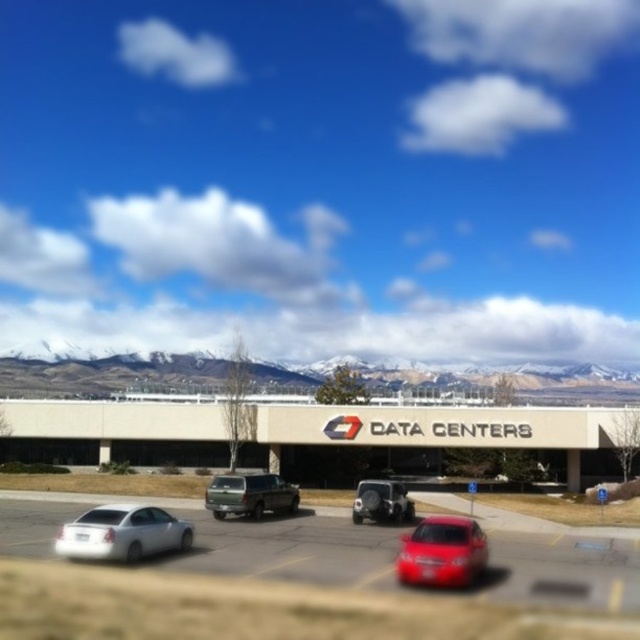
You are standing at the point labeled point [436,435]. What structure are you currently at?

The point [436,435] corresponds to the beige concrete building at center.